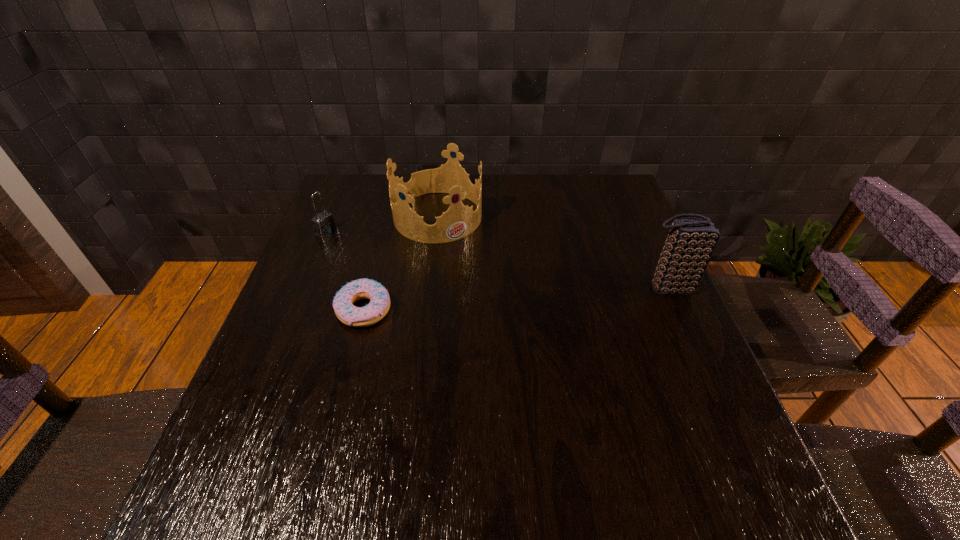
The height and width of the screenshot is (540, 960). I want to click on free location located on the front-facing side of the third shortest object, so click(x=544, y=338).

You are a GUI agent. You are given a task and a screenshot of the screen. Output one action in this format:
    pyautogui.click(x=<x>, y=<y>)
    Task: Click on the vacant space positioned on the front-facing side of the third shortest object
    The width and height of the screenshot is (960, 540).
    Given the screenshot: What is the action you would take?
    pyautogui.click(x=539, y=332)

Locate an element on the screen. Image resolution: width=960 pixels, height=540 pixels. free space located 0.110m on the front-facing side of the third shortest object is located at coordinates (478, 262).

The height and width of the screenshot is (540, 960). Identify the location of object situated at the far edge. (459, 221).

At what (x,y) coordinates should I click in order to perform the action: click on doughnut situated at the left edge. Please return your answer as a coordinate pair (x, y). Image resolution: width=960 pixels, height=540 pixels. Looking at the image, I should click on (346, 312).

I want to click on padlock at the left edge, so click(x=324, y=224).

The image size is (960, 540). In order to click on object that is at the right edge in this screenshot , I will do `click(691, 242)`.

Where is `vacant area at the far edge`? Image resolution: width=960 pixels, height=540 pixels. vacant area at the far edge is located at coordinates (503, 190).

This screenshot has height=540, width=960. I want to click on free region at the near edge, so click(481, 434).

I want to click on vacant space at the right edge of the desktop, so click(601, 253).